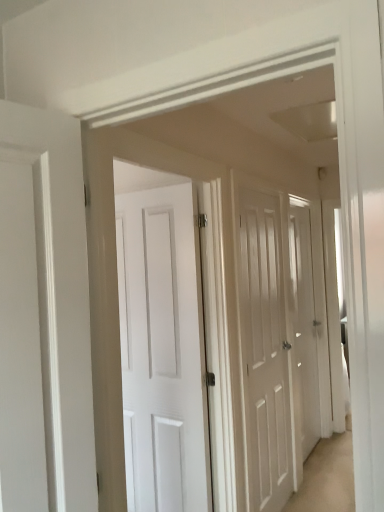
I want to click on white matte door at center, which ranks as the first door in right-to-left order, so click(x=304, y=325).

This screenshot has height=512, width=384. What do you see at coordinates (304, 325) in the screenshot? I see `white matte door at center, the 2th door from the left` at bounding box center [304, 325].

This screenshot has width=384, height=512. Describe the element at coordinates (264, 353) in the screenshot. I see `white wood door at center, which ranks as the 2th door in right-to-left order` at that location.

Where is `white wood door at center, the 1th door positioned from the left`? The width and height of the screenshot is (384, 512). white wood door at center, the 1th door positioned from the left is located at coordinates (264, 353).

This screenshot has width=384, height=512. Identify the location of white matte door at center, which is the 1th door from back to front. (304, 325).

Which is more to the right, white matte door at center, positioned as the 2th door in front-to-back order, or white wood door at center, which ranks as the 2th door in right-to-left order?

white matte door at center, positioned as the 2th door in front-to-back order.

Between white matte door at center, positioned as the 2th door in front-to-back order, and white wood door at center, the 1th door positioned from the left, which one is positioned behind?

white matte door at center, positioned as the 2th door in front-to-back order, is behind.

Is point (311, 387) positioned before point (244, 282)?

No, it is not.

From the image's perspective, which is below, white matte door at center, positioned as the 2th door in front-to-back order, or white wood door at center, which ranks as the 1th door in front-to-back order?

From the image's view, white wood door at center, which ranks as the 1th door in front-to-back order, is below.

From a real-world perspective, is white matte door at center, positioned as the 2th door in front-to-back order, positioned over white wood door at center, the 1th door positioned from the left, based on gravity?

Incorrect, from a real-world perspective, white matte door at center, positioned as the 2th door in front-to-back order, is lower than white wood door at center, the 1th door positioned from the left.

Is white matte door at center, positioned as the 2th door in front-to-back order, thinner than white wood door at center, the 1th door positioned from the left?

Yes.

Considering the sizes of objects white matte door at center, which is the 1th door from back to front, and white wood door at center, which ranks as the 1th door in front-to-back order, in the image provided, who is shorter, white matte door at center, which is the 1th door from back to front, or white wood door at center, which ranks as the 1th door in front-to-back order,?

With less height is white matte door at center, which is the 1th door from back to front.

Which of these two, white matte door at center, the 2th door from the left, or white wood door at center, which ranks as the 2th door in right-to-left order, is bigger?

Bigger between the two is white wood door at center, which ranks as the 2th door in right-to-left order.

Do you think white matte door at center, which is the 1th door from back to front, is within white wood door at center, which ranks as the 1th door in front-to-back order, or outside of it?

white matte door at center, which is the 1th door from back to front, is not inside white wood door at center, which ranks as the 1th door in front-to-back order, it's outside.

From the picture: Is white matte door at center, positioned as the 2th door in front-to-back order, with white wood door at center, the 1th door positioned from the left?

No, white matte door at center, positioned as the 2th door in front-to-back order, is not with white wood door at center, the 1th door positioned from the left.

In the scene shown: Is white matte door at center, which ranks as the first door in right-to-left order, facing away from white wood door at center, placed as the second door when sorted from back to front?

No.

What's the angular difference between white matte door at center, positioned as the 2th door in front-to-back order, and white wood door at center, placed as the second door when sorted from back to front,'s facing directions?

The angular difference between white matte door at center, positioned as the 2th door in front-to-back order, and white wood door at center, placed as the second door when sorted from back to front, is 0.00213 degrees.

Identify the location of door lying on the right of white wood door at center, which ranks as the 1th door in front-to-back order. The width and height of the screenshot is (384, 512). (304, 325).

Can you confirm if white wood door at center, placed as the second door when sorted from back to front, is positioned to the left of white matte door at center, the 2th door from the left?

Correct, you'll find white wood door at center, placed as the second door when sorted from back to front, to the left of white matte door at center, the 2th door from the left.

Between white wood door at center, which ranks as the 2th door in right-to-left order, and white matte door at center, positioned as the 2th door in front-to-back order, which one is positioned in front?

white wood door at center, which ranks as the 2th door in right-to-left order, is in front.

Is point (248, 474) behind point (313, 399)?

No.

From the image's perspective, which is above, white wood door at center, the 1th door positioned from the left, or white matte door at center, the 2th door from the left?

white matte door at center, the 2th door from the left.

From a real-world perspective, is white wood door at center, the 1th door positioned from the left, physically below white matte door at center, positioned as the 2th door in front-to-back order?

No, from a real-world perspective, white wood door at center, the 1th door positioned from the left, is not below white matte door at center, positioned as the 2th door in front-to-back order.

Considering the sizes of objects white wood door at center, placed as the second door when sorted from back to front, and white matte door at center, which ranks as the first door in right-to-left order, in the image provided, who is thinner, white wood door at center, placed as the second door when sorted from back to front, or white matte door at center, which ranks as the first door in right-to-left order,?

white matte door at center, which ranks as the first door in right-to-left order, is thinner.

Considering the sizes of objects white wood door at center, which ranks as the 2th door in right-to-left order, and white matte door at center, positioned as the 2th door in front-to-back order, in the image provided, who is taller, white wood door at center, which ranks as the 2th door in right-to-left order, or white matte door at center, positioned as the 2th door in front-to-back order,?

white wood door at center, which ranks as the 2th door in right-to-left order.

Which of these two, white wood door at center, the 1th door positioned from the left, or white matte door at center, the 2th door from the left, is bigger?

white wood door at center, the 1th door positioned from the left, is bigger.

Which is correct: white wood door at center, placed as the second door when sorted from back to front, is inside white matte door at center, the 2th door from the left, or outside of it?

white wood door at center, placed as the second door when sorted from back to front, lies outside white matte door at center, the 2th door from the left.

Is white wood door at center, which ranks as the 1th door in front-to-back order, positioned far away from white matte door at center, the 2th door from the left?

white wood door at center, which ranks as the 1th door in front-to-back order, is near white matte door at center, the 2th door from the left, not far away.

Does white wood door at center, the 1th door positioned from the left, turn towards white matte door at center, positioned as the 2th door in front-to-back order?

No, white wood door at center, the 1th door positioned from the left, is not aimed at white matte door at center, positioned as the 2th door in front-to-back order.

How far apart are white wood door at center, which ranks as the 2th door in right-to-left order, and white matte door at center, which ranks as the first door in right-to-left order?

white wood door at center, which ranks as the 2th door in right-to-left order, is 51.89 centimeters from white matte door at center, which ranks as the first door in right-to-left order.

Identify the location of door above the white wood door at center, which ranks as the 1th door in front-to-back order (from the image's perspective). point(304,325).

Identify the location of door that appears above the white wood door at center, which ranks as the 2th door in right-to-left order (from the image's perspective). (304, 325).

Find the location of a particular element. door above the white matte door at center, which is the 1th door from back to front (from a real-world perspective) is located at coordinates (264, 353).